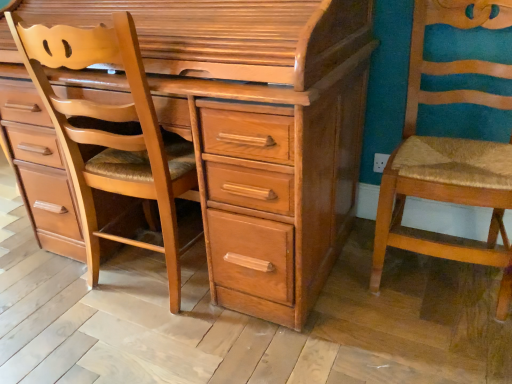
This screenshot has width=512, height=384. Describe the element at coordinates (449, 152) in the screenshot. I see `wooden textured chair at right` at that location.

Where is `light brown wood chair at left`? The height and width of the screenshot is (384, 512). light brown wood chair at left is located at coordinates (112, 134).

You are a GUI agent. You are given a task and a screenshot of the screen. Output one action in this format:
    pyautogui.click(x=<x>, y=<y>)
    Task: Click on the wooden textured chair at right
    This screenshot has width=512, height=384.
    Given the screenshot: What is the action you would take?
    pyautogui.click(x=449, y=152)

Is light brown wood chest of drawers at center not near wooden textured chair at right?

No, light brown wood chest of drawers at center is not far away from wooden textured chair at right.

Is light brown wood chest of drawers at center at the left side of wooden textured chair at right?

Yes, light brown wood chest of drawers at center is to the left of wooden textured chair at right.

How different are the orientations of light brown wood chest of drawers at center and wooden textured chair at right in degrees?

1.07 degrees separate the facing orientations of light brown wood chest of drawers at center and wooden textured chair at right.

You are a GUI agent. You are given a task and a screenshot of the screen. Output one action in this format:
    pyautogui.click(x=<x>, y=<y>)
    Task: Click on the chair on the right of light brown wood chest of drawers at center
    
    Given the screenshot: What is the action you would take?
    pyautogui.click(x=449, y=152)

Is wooden textured chair at right facing towards light brown wood chest of drawers at center?

No, wooden textured chair at right is not facing towards light brown wood chest of drawers at center.

From a real-world perspective, is wooden textured chair at right above or below light brown wood chest of drawers at center?

Clearly, from a real-world perspective, wooden textured chair at right is below light brown wood chest of drawers at center.

You are a GUI agent. You are given a task and a screenshot of the screen. Output one action in this format:
    pyautogui.click(x=<x>, y=<y>)
    Task: Click on the chair behind the light brown wood chest of drawers at center
    This screenshot has width=512, height=384.
    Given the screenshot: What is the action you would take?
    pyautogui.click(x=449, y=152)

Does wooden textured chair at right appear on the left side of light brown wood chest of drawers at center?

No, wooden textured chair at right is not to the left of light brown wood chest of drawers at center.

Is light brown wood chair at left next to light brown wood chest of drawers at center and touching it?

They are not placed beside each other.

From a real-world perspective, relative to light brown wood chest of drawers at center, is light brown wood chair at left vertically above or below?

light brown wood chair at left is below light brown wood chest of drawers at center.

Does light brown wood chair at left turn towards light brown wood chest of drawers at center?

Yes.

Locate an element on the screen. chair below the light brown wood chair at left (from a real-world perspective) is located at coordinates (449, 152).

Is light brown wood chair at left far away from wooden textured chair at right?

No.

Do you think light brown wood chair at left is within wooden textured chair at right, or outside of it?

The correct answer is: outside.

Which object is further away from the camera, light brown wood chair at left or wooden textured chair at right?

light brown wood chair at left is more distant.

Based on the photo, between light brown wood chest of drawers at center and light brown wood chair at left, which one has larger width?

light brown wood chest of drawers at center.

Find the location of a particular element. The width and height of the screenshot is (512, 384). furniture on the left of the light brown wood chest of drawers at center is located at coordinates (112, 134).

Does light brown wood chest of drawers at center appear on the right side of light brown wood chair at left?

Correct, you'll find light brown wood chest of drawers at center to the right of light brown wood chair at left.

Is light brown wood chest of drawers at center facing towards light brown wood chair at left?

Yes, light brown wood chest of drawers at center is facing light brown wood chair at left.

Which object is wider, wooden textured chair at right or light brown wood chair at left?

wooden textured chair at right is wider.

Is wooden textured chair at right to the right of light brown wood chair at left from the viewer's perspective?

Yes, wooden textured chair at right is to the right of light brown wood chair at left.

Does wooden textured chair at right have a lesser height compared to light brown wood chair at left?

Yes, wooden textured chair at right is shorter than light brown wood chair at left.

How different are the orientations of wooden textured chair at right and light brown wood chair at left in degrees?

The facing directions of wooden textured chair at right and light brown wood chair at left are 180 degrees apart.

Locate an element on the screen. chest of drawers on the left of wooden textured chair at right is located at coordinates (257, 129).

The image size is (512, 384). In order to click on chair below the light brown wood chest of drawers at center (from the image's perspective) in this screenshot , I will do `click(449, 152)`.

Looking at the image, which one is located closer to wooden textured chair at right, light brown wood chest of drawers at center or light brown wood chair at left?

Based on the image, light brown wood chest of drawers at center appears to be nearer to wooden textured chair at right.

Looking at the image, which one is located closer to light brown wood chair at left, wooden textured chair at right or light brown wood chest of drawers at center?

Based on the image, light brown wood chest of drawers at center appears to be nearer to light brown wood chair at left.

Estimate the real-world distances between objects in this image. Which object is closer to light brown wood chair at left, light brown wood chest of drawers at center or wooden textured chair at right?

Among the two, light brown wood chest of drawers at center is located nearer to light brown wood chair at left.

When comparing their distances from light brown wood chest of drawers at center, does wooden textured chair at right or light brown wood chair at left seem further?

wooden textured chair at right.

Looking at the image, which one is located closer to wooden textured chair at right, light brown wood chair at left or light brown wood chest of drawers at center?

Based on the image, light brown wood chest of drawers at center appears to be nearer to wooden textured chair at right.

Looking at the image, which one is located further to light brown wood chest of drawers at center, light brown wood chair at left or wooden textured chair at right?

wooden textured chair at right lies further to light brown wood chest of drawers at center than the other object.

Image resolution: width=512 pixels, height=384 pixels. Find the location of `the chest of drawers located between light brown wood chair at left and wooden textured chair at right in the left-right direction`. the chest of drawers located between light brown wood chair at left and wooden textured chair at right in the left-right direction is located at coordinates (257, 129).